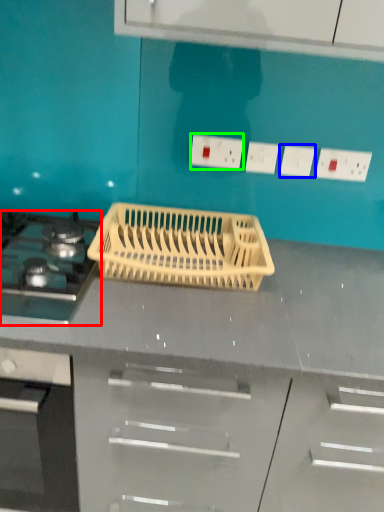
Question: Considering the real-world distances, which object is closest to gas stove (highlighted by a red box)? electric outlet (highlighted by a blue box) or electric outlet (highlighted by a green box).

Choices:
 (A) electric outlet
 (B) electric outlet

Answer: (B)